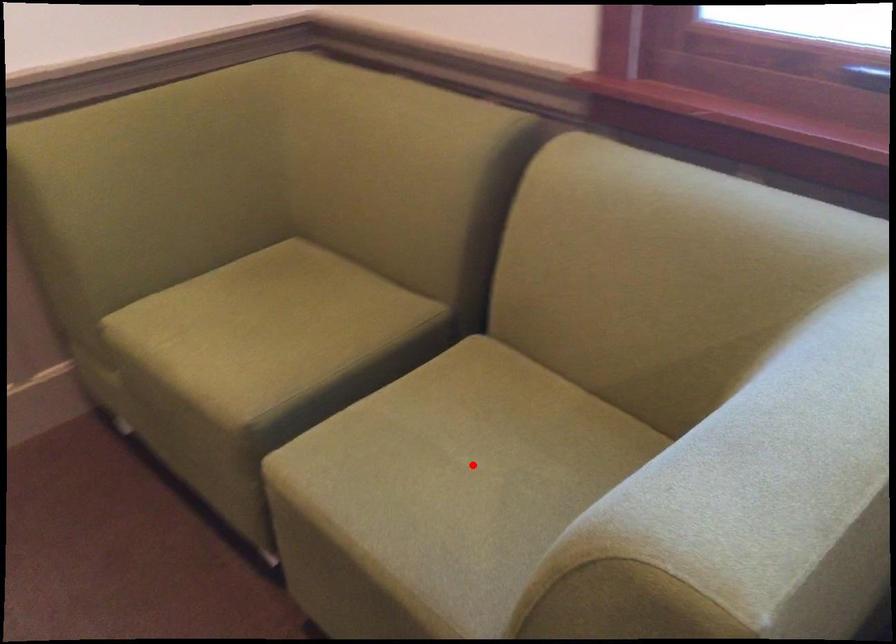
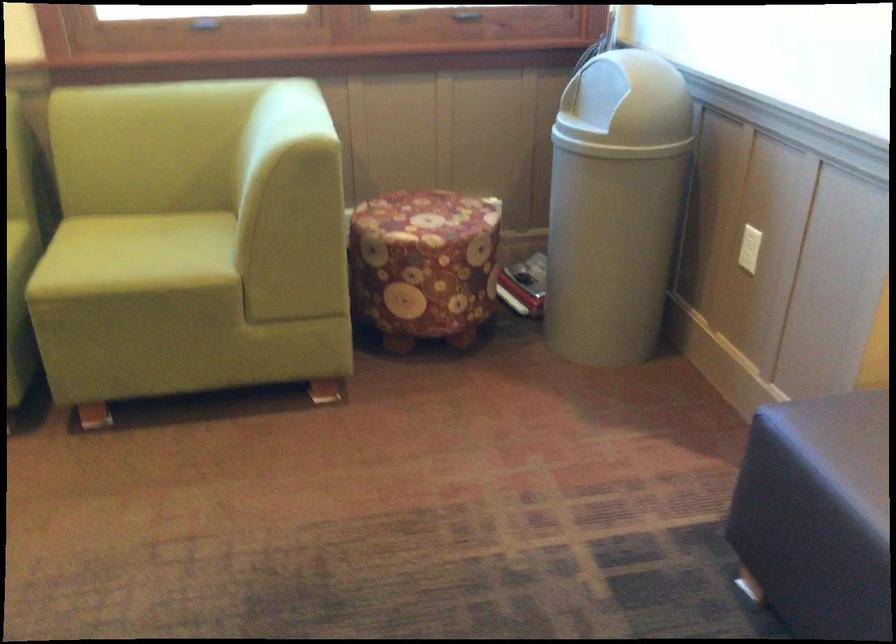
In the second image, find the point that corresponds to the highlighted location in the first image.

(142, 252)